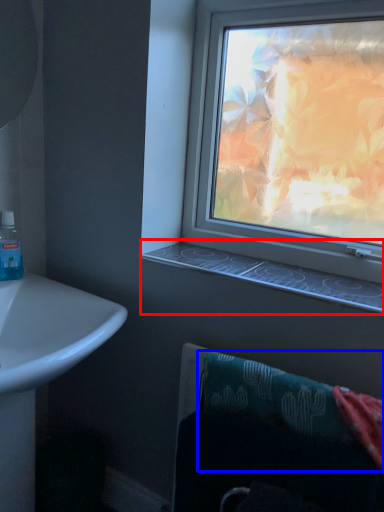
Question: Which object appears farthest to the camera in this image, window sill (highlighted by a red box) or bath towel (highlighted by a blue box)?

Choices:
 (A) window sill
 (B) bath towel

Answer: (A)